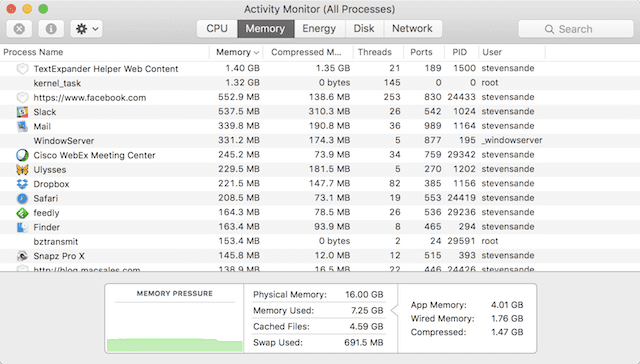
Where is `column`? Image resolution: width=640 pixels, height=364 pixels. column is located at coordinates (150, 53), (232, 49), (294, 49), (372, 53), (426, 53), (463, 53), (504, 53), (568, 53).